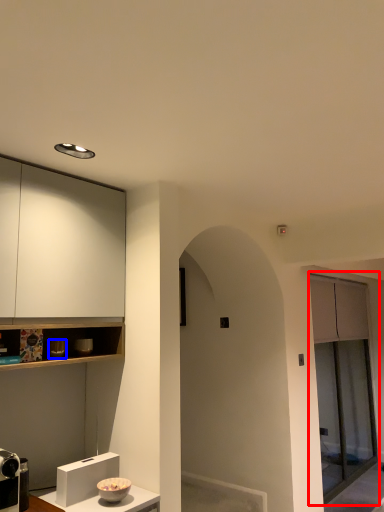
Question: Which object is further to the camera taking this photo, screen door (highlighted by a red box) or appliance (highlighted by a blue box)?

Choices:
 (A) screen door
 (B) appliance

Answer: (A)